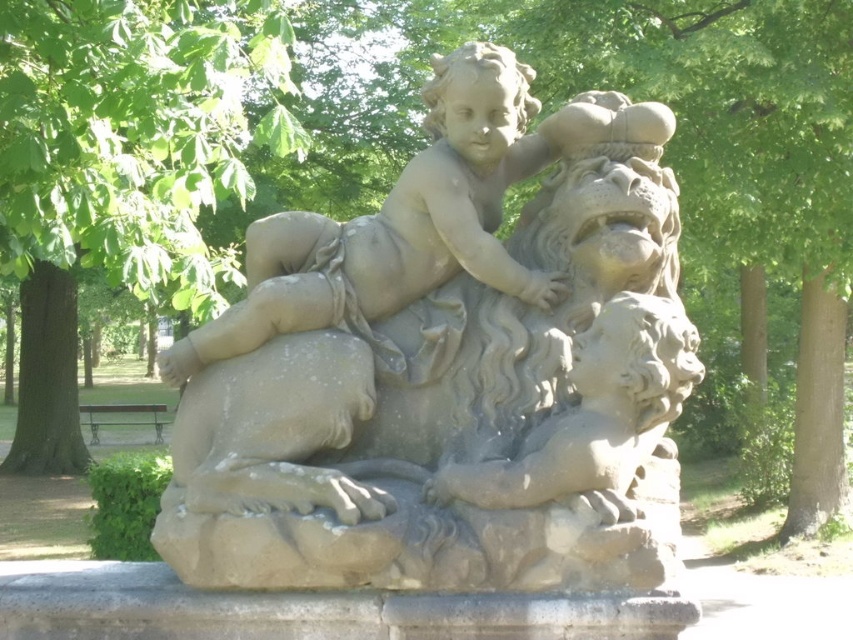
Question: Is gray stone statue at center closer to camera compared to green leafy tree at upper left?

Choices:
 (A) no
 (B) yes

Answer: (B)

Question: Among these points, which one is nearest to the camera?

Choices:
 (A) (38, 269)
 (B) (352, 268)

Answer: (B)

Question: Is the position of gray stone statue at center more distant than that of green leafy tree at upper left?

Choices:
 (A) no
 (B) yes

Answer: (A)

Question: Observing the image, what is the correct spatial positioning of gray stone statue at center in reference to green leafy tree at upper left?

Choices:
 (A) right
 (B) left

Answer: (A)

Question: Which point is closer to the camera taking this photo?

Choices:
 (A) (389, 502)
 (B) (13, 157)

Answer: (A)